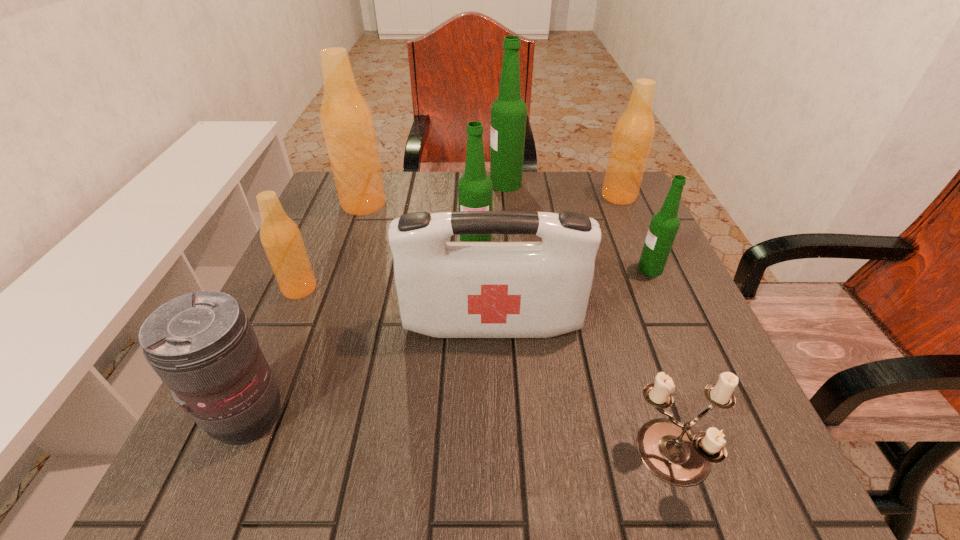
The height and width of the screenshot is (540, 960). Find the location of `the nearest tan beer bottle`. the nearest tan beer bottle is located at coordinates (280, 236).

Locate an element on the screen. telephoto lens is located at coordinates (202, 345).

Where is `candle holder`? The height and width of the screenshot is (540, 960). candle holder is located at coordinates (672, 451).

Identify the location of vacant space situated on the label of the third beer bottle from right to left. The height and width of the screenshot is (540, 960). (354, 184).

Where is `free space located 0.230m on the label of the third beer bottle from right to left`? free space located 0.230m on the label of the third beer bottle from right to left is located at coordinates (408, 184).

You are a GUI agent. You are given a task and a screenshot of the screen. Output one action in this format:
    pyautogui.click(x=<x>, y=<y>)
    Task: Click on the free location located on the label of the third beer bottle from right to left
    This screenshot has width=960, height=540.
    Given the screenshot: What is the action you would take?
    pyautogui.click(x=465, y=184)

Image resolution: width=960 pixels, height=540 pixels. I want to click on blank area located 0.110m on the front of the biggest tan beer bottle, so click(x=349, y=244).

Image resolution: width=960 pixels, height=540 pixels. What are the coordinates of `vacant region located on the left of the rightmost tan beer bottle` in the screenshot? It's located at (571, 196).

The height and width of the screenshot is (540, 960). I want to click on free space located on the label of the fourth farthest beer bottle, so click(x=475, y=320).

You are a GUI agent. You are given a task and a screenshot of the screen. Output one action in this format:
    pyautogui.click(x=<x>, y=<y>)
    Task: Click on the free space located on the front side of the first-aid kit
    The image size is (960, 540).
    Given the screenshot: What is the action you would take?
    pyautogui.click(x=493, y=367)